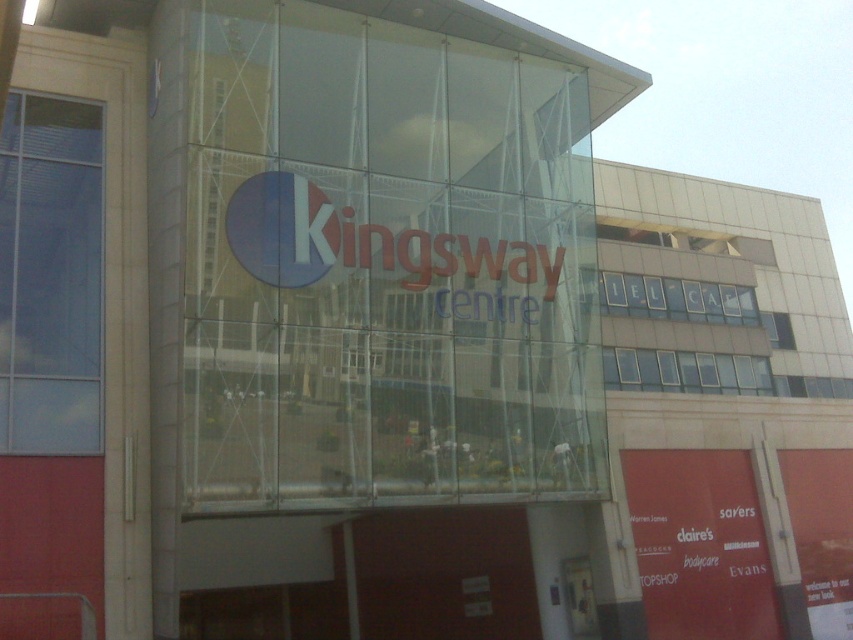
Question: Which object is farther from the camera taking this photo?

Choices:
 (A) matte red sign at lower right
 (B) transparent glass kingsway centre sign at center

Answer: (A)

Question: Does transparent glass kingsway centre sign at center appear under matte red sign at lower right?

Choices:
 (A) yes
 (B) no

Answer: (B)

Question: Can you confirm if transparent glass kingsway centre sign at center is wider than matte red sign at lower right?

Choices:
 (A) no
 (B) yes

Answer: (B)

Question: Is the position of transparent glass kingsway centre sign at center more distant than that of matte red sign at lower right?

Choices:
 (A) no
 (B) yes

Answer: (A)

Question: Which object is closer to the camera taking this photo?

Choices:
 (A) transparent glass kingsway centre sign at center
 (B) matte red sign at lower right

Answer: (A)